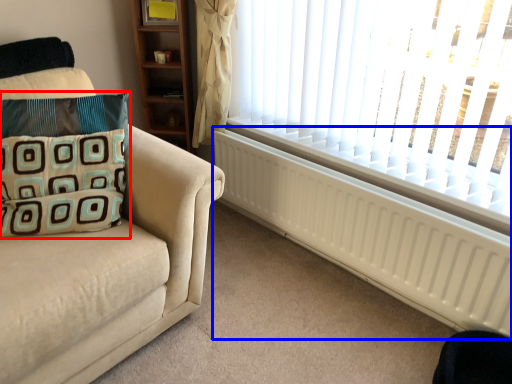
Question: Which object appears farthest to the camera in this image, pillow (highlighted by a red box) or radiator (highlighted by a blue box)?

Choices:
 (A) pillow
 (B) radiator

Answer: (B)